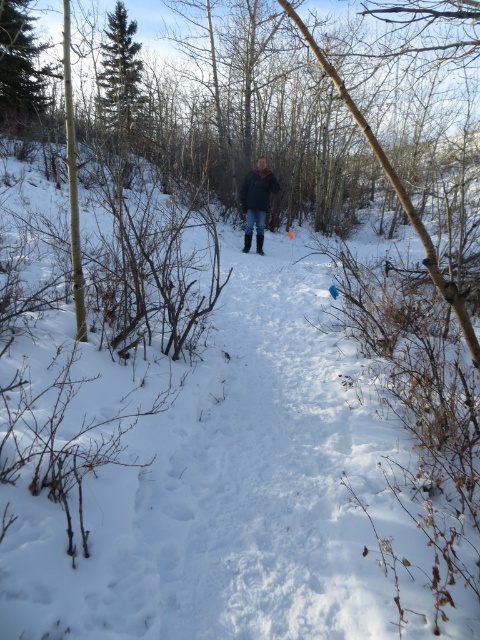
Which is behind, point (130, 96) or point (245, 237)?

Point (130, 96)

Does green matte tree at upper left have a lesser height compared to dark blue jacket at center?

No.

Does point (120, 48) come farther from viewer compared to point (267, 189)?

Yes, it is behind point (267, 189).

The width and height of the screenshot is (480, 640). Find the location of `green matte tree at upper left`. green matte tree at upper left is located at coordinates (120, 81).

Who is positioned more to the right, green leafy tree at upper left or dark blue jacket at center?

dark blue jacket at center

Is the position of green leafy tree at upper left more distant than that of dark blue jacket at center?

Yes, green leafy tree at upper left is further from the viewer.

The width and height of the screenshot is (480, 640). What do you see at coordinates (21, 65) in the screenshot?
I see `green leafy tree at upper left` at bounding box center [21, 65].

The height and width of the screenshot is (640, 480). Find the location of `green leafy tree at upper left`. green leafy tree at upper left is located at coordinates (21, 65).

Does green matte tree at upper left appear on the left side of green leafy tree at upper left?

Incorrect, green matte tree at upper left is not on the left side of green leafy tree at upper left.

Does green matte tree at upper left have a smaller size compared to green leafy tree at upper left?

No.

Does point (134, 72) lie in front of point (3, 13)?

No.

Where is `green matte tree at upper left`? green matte tree at upper left is located at coordinates (120, 81).